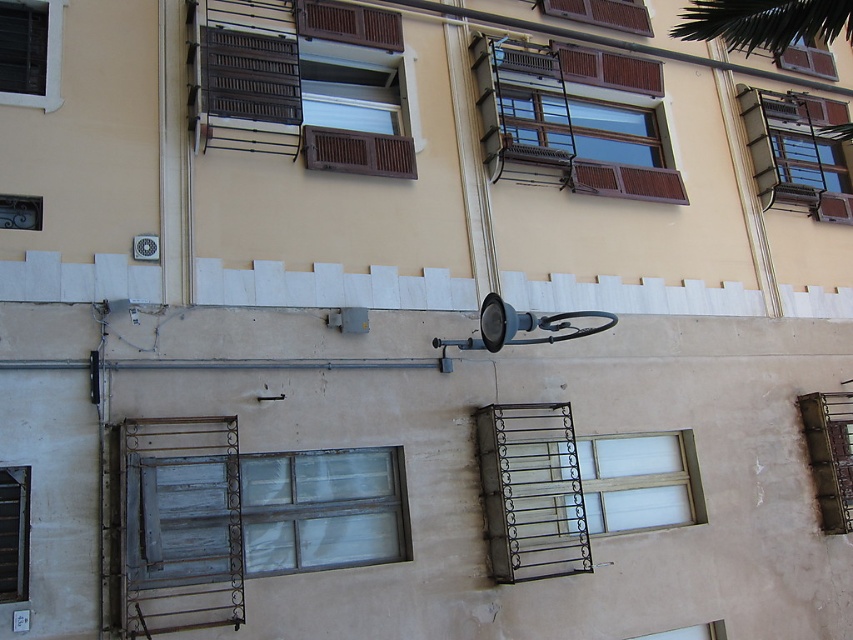
Which is more to the right, wooden at upper center or white wooden window at upper left?

wooden at upper center is more to the right.

Between point (596, 77) and point (10, 99), which one is positioned in front?

Point (10, 99)

Identify the location of wooden at upper center. Image resolution: width=853 pixels, height=640 pixels. (608, 68).

The width and height of the screenshot is (853, 640). What are the coordinates of `wooden at upper center` in the screenshot? It's located at (608, 68).

Does wooden shutters at upper center lie behind white wooden window at upper left?

Yes, it is behind white wooden window at upper left.

Between wooden shutters at upper center and white wooden window at upper left, which one appears on the right side from the viewer's perspective?

wooden shutters at upper center

Is point (639, 17) in front of point (55, 97)?

That is False.

Where is `wooden shutters at upper center`? wooden shutters at upper center is located at coordinates (601, 13).

Can you confirm if brown wooden balcony at upper center is positioned to the right of black wrought iron balcony at center?

Incorrect, brown wooden balcony at upper center is not on the right side of black wrought iron balcony at center.

Can you confirm if brown wooden balcony at upper center is positioned below black wrought iron balcony at center?

No.

Where is `brown wooden balcony at upper center`? This screenshot has width=853, height=640. brown wooden balcony at upper center is located at coordinates (281, 83).